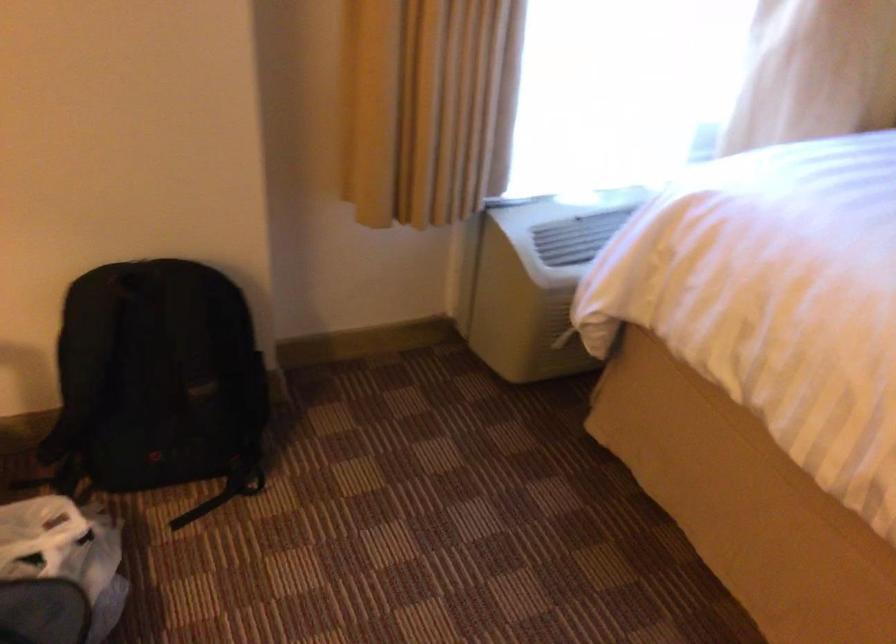
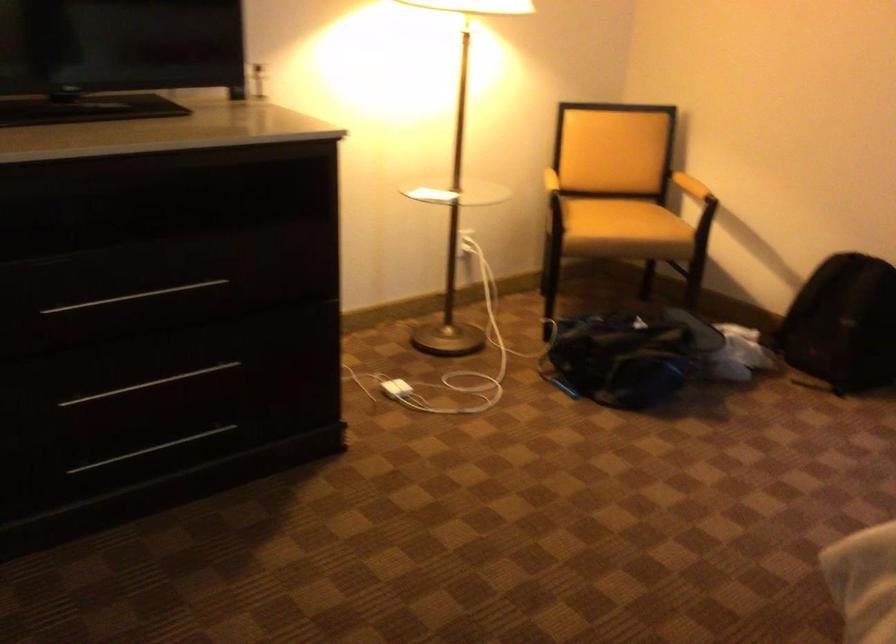
Find the pixel in the second image that matches pixel 233 412 in the first image.

(842, 324)